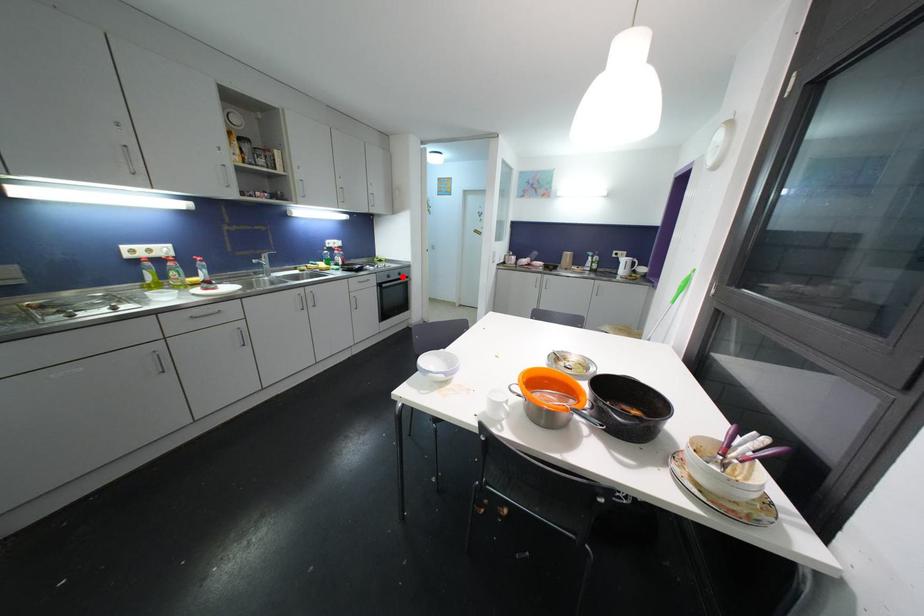
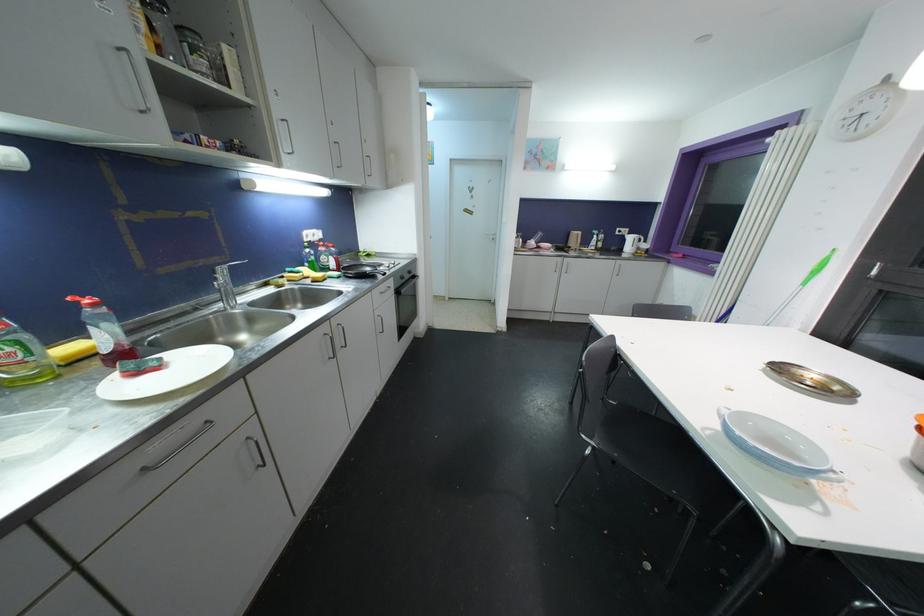
Find the pixel in the second image that matches the highlighted location in the first image.

(412, 275)